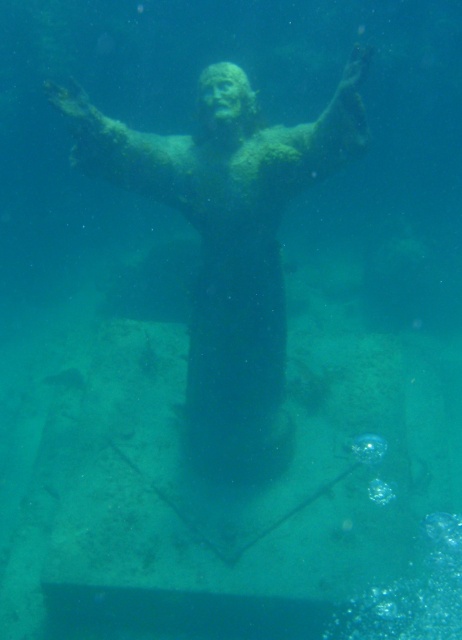
Between greenish stone statue at center and transparent gel-like bubble at center, which one is positioned lower?

transparent gel-like bubble at center is below.

Between greenish stone statue at center and transparent gel-like bubble at center, which one is positioned higher?

Positioned higher is greenish stone statue at center.

Which is behind, point (98, 124) or point (368, 440)?

The point (368, 440) is more distant.

Locate an element on the screen. The image size is (462, 640). greenish stone statue at center is located at coordinates (229, 244).